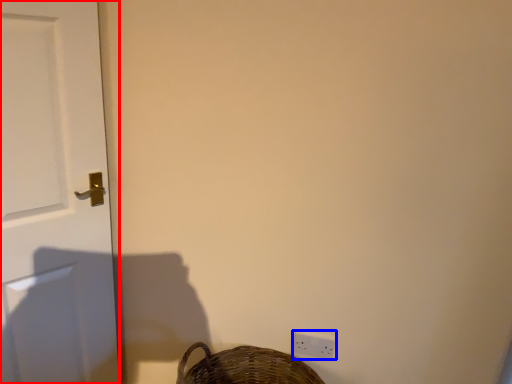
Question: Which point is further to the camera, door (highlighted by a red box) or light switch (highlighted by a blue box)?

Choices:
 (A) door
 (B) light switch

Answer: (B)